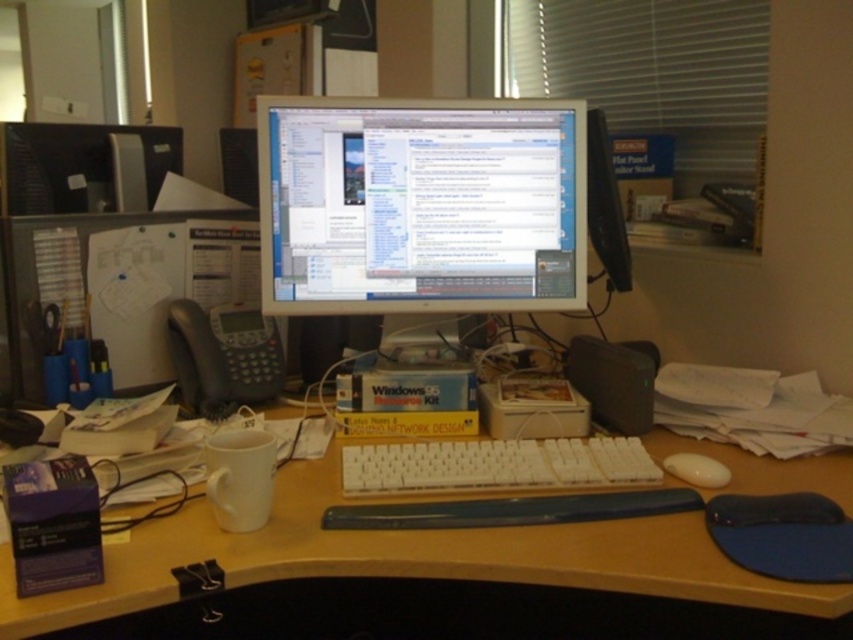
Is wooden desk at center to the right of white blinds at upper right from the viewer's perspective?

Incorrect, wooden desk at center is not on the right side of white blinds at upper right.

Does wooden desk at center have a greater width compared to white blinds at upper right?

Indeed, wooden desk at center has a greater width compared to white blinds at upper right.

Is point (318, 513) farther from camera compared to point (596, 86)?

No, (318, 513) is in front of (596, 86).

Identify the location of wooden desk at center. The width and height of the screenshot is (853, 640). (408, 557).

Does white blinds at upper right have a greater height compared to white matte mouse at lower right?

Correct, white blinds at upper right is much taller as white matte mouse at lower right.

Does point (701, 170) come closer to viewer compared to point (698, 477)?

No, it is behind (698, 477).

Between point (695, 64) and point (705, 484), which one is positioned in front?

Point (705, 484) is more forward.

Where is `white blinds at upper right`? white blinds at upper right is located at coordinates (653, 68).

Which is more to the left, wooden desk at center or white matte mouse at lower right?

wooden desk at center

Which is in front, point (386, 557) or point (675, 458)?

Point (386, 557)

The width and height of the screenshot is (853, 640). I want to click on wooden desk at center, so click(x=408, y=557).